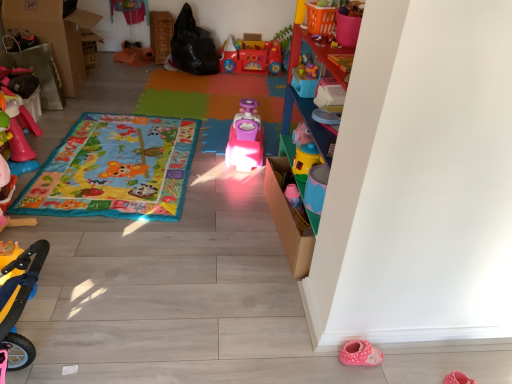
Question: Could you tell me if yellow plastic scooter at lower left, acting as the eighth toy starting from the back, is turned towards matte pink car at center, the first blanket when ordered from back to front?

Choices:
 (A) yes
 (B) no

Answer: (B)

Question: Is the depth of yellow plastic scooter at lower left, the fourth toy positioned from the left, less than that of matte pink car at center, arranged as the second blanket when viewed from the front?

Choices:
 (A) yes
 (B) no

Answer: (A)

Question: Can you confirm if yellow plastic scooter at lower left, arranged as the first toy when viewed from the front, is shorter than matte pink car at center, arranged as the second blanket when viewed from the front?

Choices:
 (A) no
 (B) yes

Answer: (A)

Question: Would you consider yellow plastic scooter at lower left, the fourth toy positioned from the left, to be distant from matte pink car at center, arranged as the second blanket when viewed from the front?

Choices:
 (A) yes
 (B) no

Answer: (A)

Question: From a real-world perspective, does yellow plastic scooter at lower left, placed as the 5th toy when sorted from right to left, stand above matte pink car at center, the first blanket when ordered from back to front?

Choices:
 (A) yes
 (B) no

Answer: (A)

Question: From the image's perspective, is yellow plastic cup at upper right, marked as the third toy in a front-to-back arrangement, located above or below black matte bag at upper center?

Choices:
 (A) above
 (B) below

Answer: (B)

Question: From a real-world perspective, is yellow plastic cup at upper right, acting as the sixth toy starting from the back, above or below black matte bag at upper center?

Choices:
 (A) below
 (B) above

Answer: (B)

Question: Is yellow plastic cup at upper right, marked as the third toy in a front-to-back arrangement, to the left or to the right of black matte bag at upper center in the image?

Choices:
 (A) right
 (B) left

Answer: (A)

Question: Considering the positions of yellow plastic cup at upper right, marked as the third toy in a front-to-back arrangement, and black matte bag at upper center in the image, is yellow plastic cup at upper right, marked as the third toy in a front-to-back arrangement, taller or shorter than black matte bag at upper center?

Choices:
 (A) short
 (B) tall

Answer: (A)

Question: Is rubberized red toy car at center, which appears as the 8th toy when viewed from the front, bigger or smaller than orange plastic basket at upper center, which appears as the eighth toy when viewed from the left?

Choices:
 (A) small
 (B) big

Answer: (B)

Question: From their relative heights in the image, would you say rubberized red toy car at center, which appears as the 8th toy when viewed from the front, is taller or shorter than orange plastic basket at upper center, the 2th toy in the front-to-back sequence?

Choices:
 (A) tall
 (B) short

Answer: (A)

Question: Would you say rubberized red toy car at center, which ranks as the 6th toy in left-to-right order, is inside or outside orange plastic basket at upper center, which appears as the eighth toy when viewed from the left?

Choices:
 (A) inside
 (B) outside

Answer: (B)

Question: From a real-world perspective, is rubberized red toy car at center, which is the 3th toy in right-to-left order, positioned above or below orange plastic basket at upper center, arranged as the seventh toy when viewed from the back?

Choices:
 (A) below
 (B) above

Answer: (A)

Question: Considering the positions of yellow plastic scooter at lower left, acting as the eighth toy starting from the back, and rubberized pink toy at left, positioned as the 1th toy in left-to-right order, in the image, is yellow plastic scooter at lower left, acting as the eighth toy starting from the back, taller or shorter than rubberized pink toy at left, positioned as the 1th toy in left-to-right order,?

Choices:
 (A) tall
 (B) short

Answer: (A)

Question: From the image's perspective, is yellow plastic scooter at lower left, the fourth toy positioned from the left, positioned above or below rubberized pink toy at left, placed as the 5th toy when sorted from front to back?

Choices:
 (A) above
 (B) below

Answer: (B)